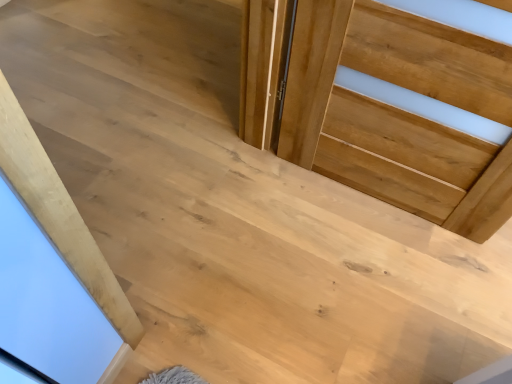
You are a GUI agent. You are given a task and a screenshot of the screen. Output one action in this format:
    pyautogui.click(x=<x>, y=<y>)
    Task: Click on the free location to the left of natural wood chest of drawers at right
    The width and height of the screenshot is (512, 384).
    Given the screenshot: What is the action you would take?
    [282, 229]